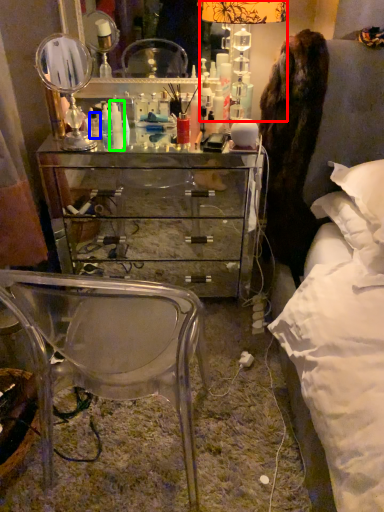
Question: Which object is positioned closest to table lamp (highlighted by a red box)? Select from toiletry (highlighted by a blue box) and toiletry (highlighted by a green box).

Choices:
 (A) toiletry
 (B) toiletry

Answer: (B)